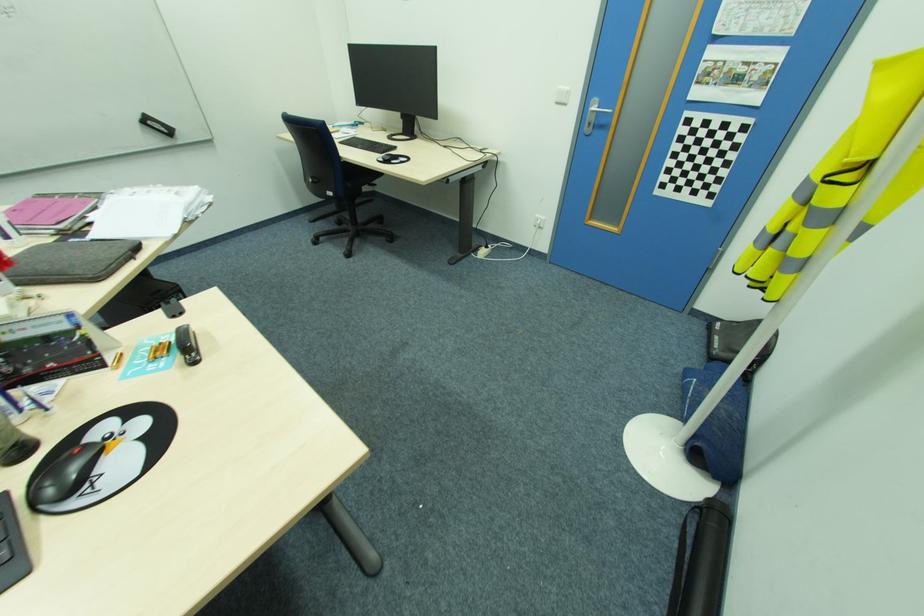
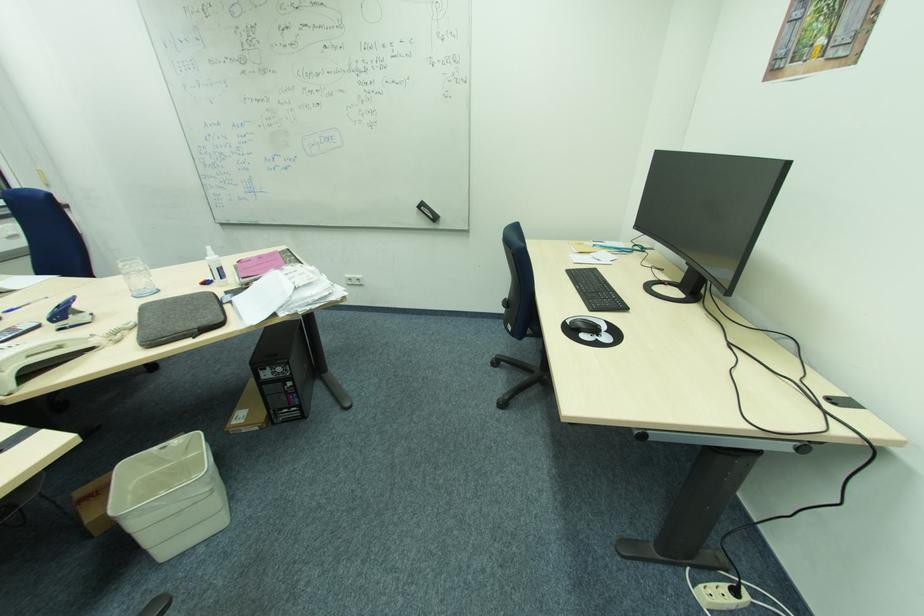
Locate, in the second image, the point that corresponds to pixel 151 123 in the first image.

(426, 208)